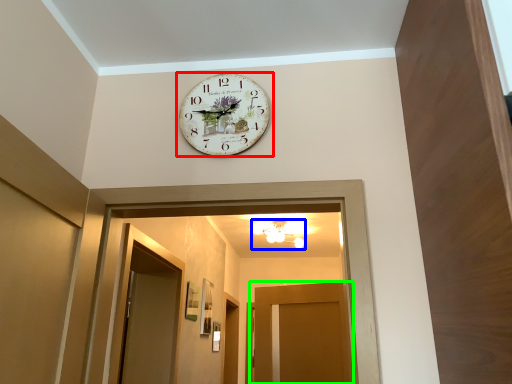
Question: Estimate the real-world distances between objects in this image. Which object is farther from wall clock (highlighted by a red box), light fixture (highlighted by a blue box) or door (highlighted by a green box)?

Choices:
 (A) light fixture
 (B) door

Answer: (A)